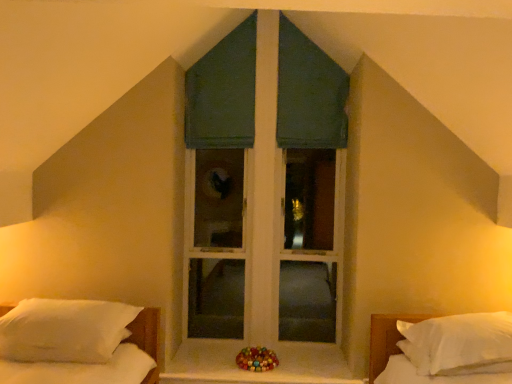
Question: Is white matte window sill at center positioned with its back to shiny multicolored beads at center?

Choices:
 (A) yes
 (B) no

Answer: (B)

Question: Considering the relative sizes of white matte window sill at center and shiny multicolored beads at center in the image provided, is white matte window sill at center shorter than shiny multicolored beads at center?

Choices:
 (A) yes
 (B) no

Answer: (A)

Question: Can you confirm if white matte window sill at center is positioned to the left of shiny multicolored beads at center?

Choices:
 (A) yes
 (B) no

Answer: (B)

Question: Considering the relative sizes of white matte window sill at center and shiny multicolored beads at center in the image provided, is white matte window sill at center thinner than shiny multicolored beads at center?

Choices:
 (A) no
 (B) yes

Answer: (A)

Question: Is white matte window sill at center to the right of shiny multicolored beads at center from the viewer's perspective?

Choices:
 (A) yes
 (B) no

Answer: (A)

Question: From a real-world perspective, is white matte window sill at center beneath shiny multicolored beads at center?

Choices:
 (A) no
 (B) yes

Answer: (B)

Question: Does shiny multicolored beads at center appear on the left side of white soft pillow at right, which is counted as the 2th bed, starting from the left?

Choices:
 (A) no
 (B) yes

Answer: (B)

Question: From a real-world perspective, does shiny multicolored beads at center stand above white soft pillow at right, the 1th bed in the right-to-left sequence?

Choices:
 (A) no
 (B) yes

Answer: (A)

Question: Considering the relative sizes of shiny multicolored beads at center and white soft pillow at right, which is counted as the 2th bed, starting from the left, in the image provided, is shiny multicolored beads at center thinner than white soft pillow at right, which is counted as the 2th bed, starting from the left,?

Choices:
 (A) yes
 (B) no

Answer: (A)

Question: Is shiny multicolored beads at center shorter than white soft pillow at right, which is counted as the 2th bed, starting from the left?

Choices:
 (A) no
 (B) yes

Answer: (B)

Question: Is shiny multicolored beads at center looking in the opposite direction of white soft pillow at right, which is counted as the 2th bed, starting from the left?

Choices:
 (A) no
 (B) yes

Answer: (A)

Question: Is shiny multicolored beads at center further to camera compared to white soft pillow at right, the 1th bed in the right-to-left sequence?

Choices:
 (A) yes
 (B) no

Answer: (A)

Question: Is green fabric window at center looking in the opposite direction of white soft pillow at right, the 1th bed in the right-to-left sequence?

Choices:
 (A) no
 (B) yes

Answer: (A)